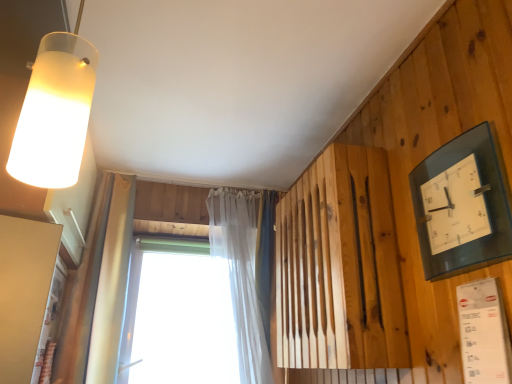
Question: Does transparent glass clock at upper right have a lesser width compared to transparent plastic window at center?

Choices:
 (A) yes
 (B) no

Answer: (A)

Question: From the image's perspective, is transparent glass clock at upper right under transparent plastic window at center?

Choices:
 (A) yes
 (B) no

Answer: (B)

Question: From a real-world perspective, is transparent glass clock at upper right physically below transparent plastic window at center?

Choices:
 (A) yes
 (B) no

Answer: (B)

Question: Is transparent plastic window at center a part of transparent glass clock at upper right?

Choices:
 (A) yes
 (B) no

Answer: (B)

Question: Is transparent glass clock at upper right facing away from transparent plastic window at center?

Choices:
 (A) yes
 (B) no

Answer: (B)

Question: Is transparent glass clock at upper right in front of transparent plastic window at center?

Choices:
 (A) yes
 (B) no

Answer: (A)

Question: Is frosted glass lampshade at upper left bigger than translucent fabric curtain at upper center?

Choices:
 (A) no
 (B) yes

Answer: (A)

Question: Are frosted glass lampshade at upper left and translucent fabric curtain at upper center far apart?

Choices:
 (A) yes
 (B) no

Answer: (A)

Question: Is the position of frosted glass lampshade at upper left less distant than that of translucent fabric curtain at upper center?

Choices:
 (A) no
 (B) yes

Answer: (B)

Question: Are frosted glass lampshade at upper left and translucent fabric curtain at upper center beside each other?

Choices:
 (A) no
 (B) yes

Answer: (A)

Question: Does frosted glass lampshade at upper left have a lesser width compared to translucent fabric curtain at upper center?

Choices:
 (A) no
 (B) yes

Answer: (B)

Question: From a real-world perspective, is frosted glass lampshade at upper left located higher than translucent fabric curtain at upper center?

Choices:
 (A) no
 (B) yes

Answer: (B)

Question: Is transparent plastic window at center positioned beyond the bounds of transparent glass clock at upper right?

Choices:
 (A) yes
 (B) no

Answer: (A)